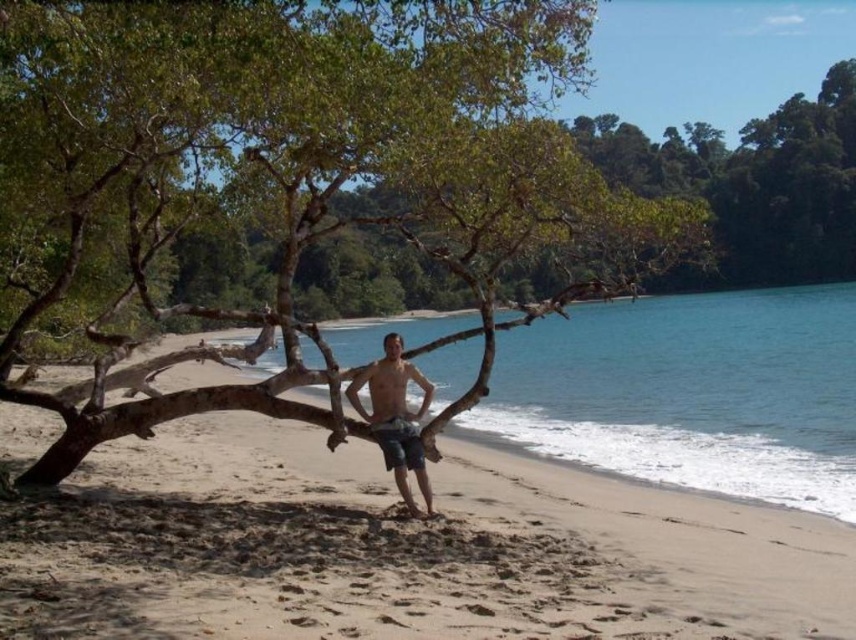
You are standing at the point marked by the coordinates point (400, 548) on the sandy beach at center. Looking towards the turquoise water of the sea, which direction would you face?

The point (400, 548) marks the sandy beach at center, so facing towards the turquoise water of the sea would mean you are facing north.